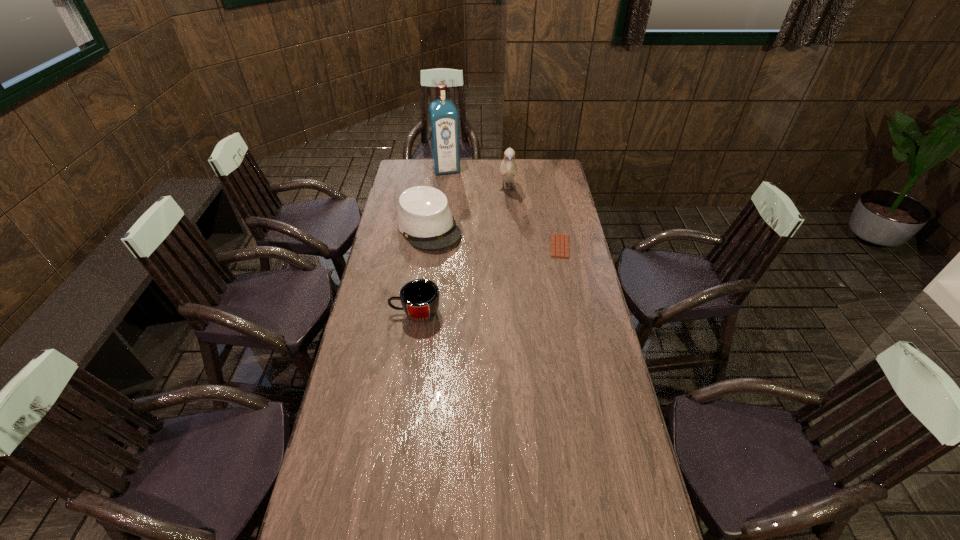
What are the coordinates of `free space between the shortest object and the second farthest object` in the screenshot? It's located at pyautogui.click(x=534, y=218).

Where is `vacant area between the hat and the fourth tallest object`? This screenshot has height=540, width=960. vacant area between the hat and the fourth tallest object is located at coordinates (422, 271).

Find the location of `free point between the mug and the third shortest object`. free point between the mug and the third shortest object is located at coordinates (422, 271).

Find the location of a particular element. The width and height of the screenshot is (960, 540). free space between the rightmost object and the third shortest object is located at coordinates (494, 237).

The width and height of the screenshot is (960, 540). What are the coordinates of `blank region between the second object from right to left and the nearest object` in the screenshot? It's located at (462, 252).

Find the location of a particular element. The height and width of the screenshot is (540, 960). free spot between the second shortest object and the hat is located at coordinates (422, 271).

Identify the location of object that stands as the fourth closest to the tallest object. (420, 298).

This screenshot has width=960, height=540. Identify the location of the fourth closest object to the shortest object. (443, 116).

At what (x,y) coordinates should I click in order to perform the action: click on free point that satisfies the following two spatial constraints: 1. on the front side of the liquor; 2. on the left side of the rightmost object. Please return your answer as a coordinate pair (x, y). This screenshot has height=540, width=960. Looking at the image, I should click on (438, 246).